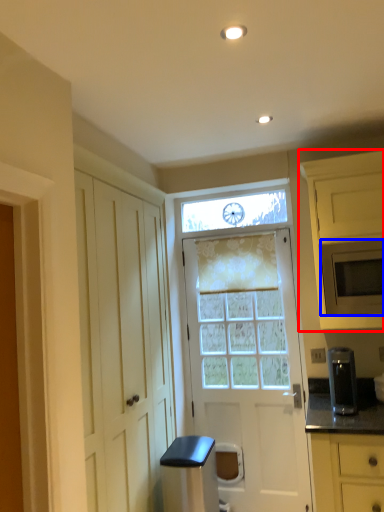
Question: Which object is closer to the camera taking this photo, cabinetry (highlighted by a red box) or microwave oven (highlighted by a blue box)?

Choices:
 (A) cabinetry
 (B) microwave oven

Answer: (A)